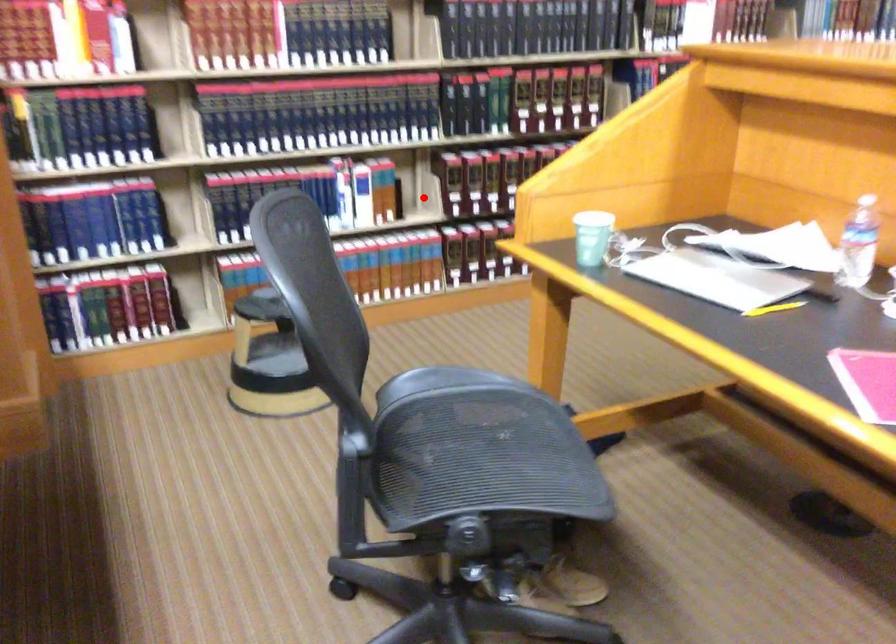
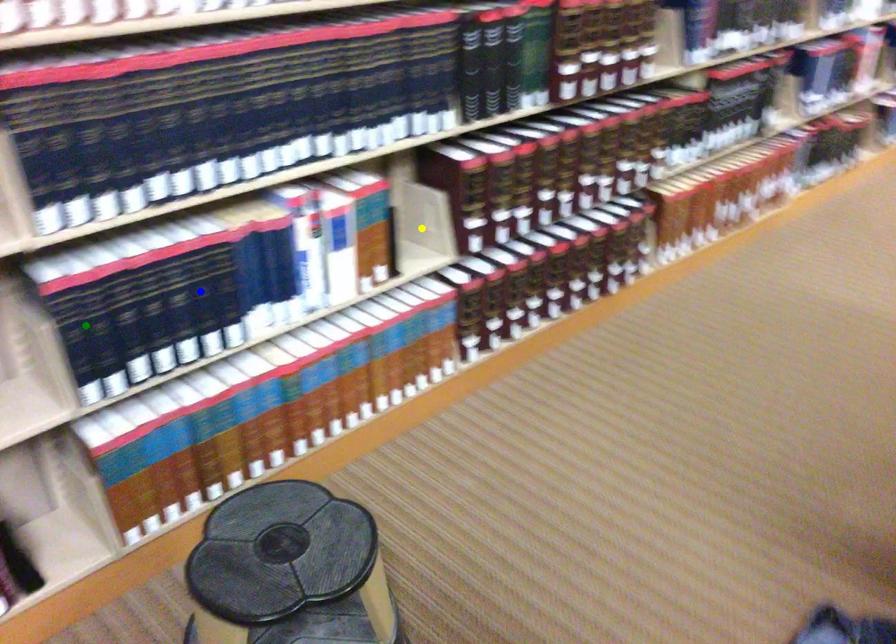
Question: I am providing you with two images of the same scene from different viewpoints. A red point is marked on the first image. You are given multiple points on the second image. Which point in image 2 represents the same 3d spot as the red point in image 1?

Choices:
 (A) green point
 (B) yellow point
 (C) blue point

Answer: (B)